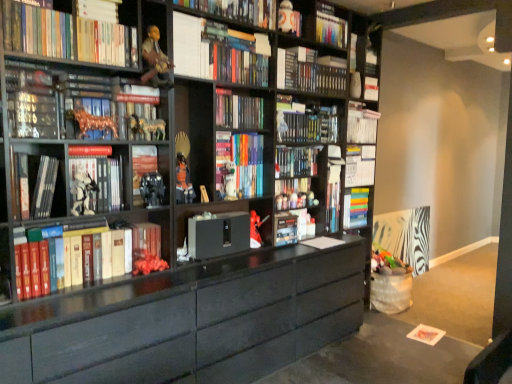
Question: Should I look upward or downward to see white matte book at upper right, the second book from the top?

Choices:
 (A) down
 (B) up

Answer: (B)

Question: Is matte black figurine at upper left, the 8th book ordered from the bottom, at the right side of matte black figurine at center, the 4th toy from the back?

Choices:
 (A) yes
 (B) no

Answer: (B)

Question: Considering the relative sizes of matte black figurine at upper left, the seventh book positioned from the top, and matte black figurine at center, placed as the fourth toy when sorted from top to bottom, in the image provided, is matte black figurine at upper left, the seventh book positioned from the top, smaller than matte black figurine at center, placed as the fourth toy when sorted from top to bottom,?

Choices:
 (A) no
 (B) yes

Answer: (A)

Question: From the image's perspective, is matte black figurine at upper left, the 8th book ordered from the bottom, on matte black figurine at center, which ranks as the 2th toy in bottom-to-top order?

Choices:
 (A) no
 (B) yes

Answer: (B)

Question: Considering the relative sizes of matte black figurine at upper left, the seventh book positioned from the top, and matte black figurine at center, which ranks as the 2th toy in bottom-to-top order, in the image provided, is matte black figurine at upper left, the seventh book positioned from the top, wider than matte black figurine at center, which ranks as the 2th toy in bottom-to-top order,?

Choices:
 (A) no
 (B) yes

Answer: (B)

Question: Is matte black figurine at upper left, the 8th book ordered from the bottom, further to camera compared to matte black figurine at center, the 4th toy from the back?

Choices:
 (A) yes
 (B) no

Answer: (A)

Question: Is matte black figurine at upper left, the 8th book ordered from the bottom, facing away from matte black figurine at center, placed as the fourth toy when sorted from top to bottom?

Choices:
 (A) yes
 (B) no

Answer: (B)

Question: Can you confirm if matte black cabinet at center is smaller than hardcover book at left, positioned as the 4th book in bottom-to-top order?

Choices:
 (A) yes
 (B) no

Answer: (B)

Question: Does matte black cabinet at center have a greater width compared to hardcover book at left, the eleventh book in the top-to-bottom sequence?

Choices:
 (A) yes
 (B) no

Answer: (B)

Question: Is matte black cabinet at center positioned in front of hardcover book at left, positioned as the 4th book in bottom-to-top order?

Choices:
 (A) yes
 (B) no

Answer: (B)

Question: Is matte black cabinet at center shorter than hardcover book at left, positioned as the 4th book in bottom-to-top order?

Choices:
 (A) yes
 (B) no

Answer: (A)

Question: Can you confirm if matte black cabinet at center is thinner than hardcover book at left, positioned as the 4th book in bottom-to-top order?

Choices:
 (A) no
 (B) yes

Answer: (B)

Question: Is matte black cabinet at center at the right side of hardcover book at left, positioned as the 4th book in bottom-to-top order?

Choices:
 (A) yes
 (B) no

Answer: (A)

Question: Does white glossy book at upper left, which is the twelfth book in bottom-to-top order, come behind hardcover book at upper center, positioned as the eleventh book in bottom-to-top order?

Choices:
 (A) yes
 (B) no

Answer: (B)